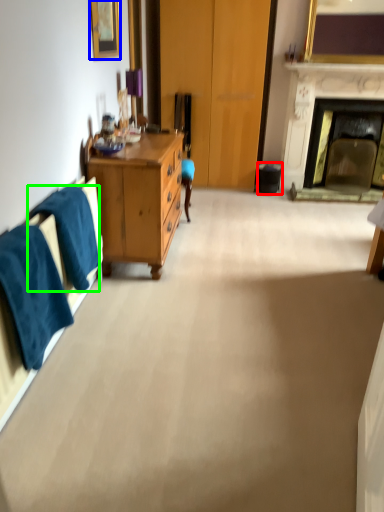
Question: Based on their relative distances, which object is farther from trash bin/can (highlighted by a red box)? Choose from picture frame (highlighted by a blue box) and towel/napkin (highlighted by a green box).

Choices:
 (A) picture frame
 (B) towel/napkin

Answer: (B)